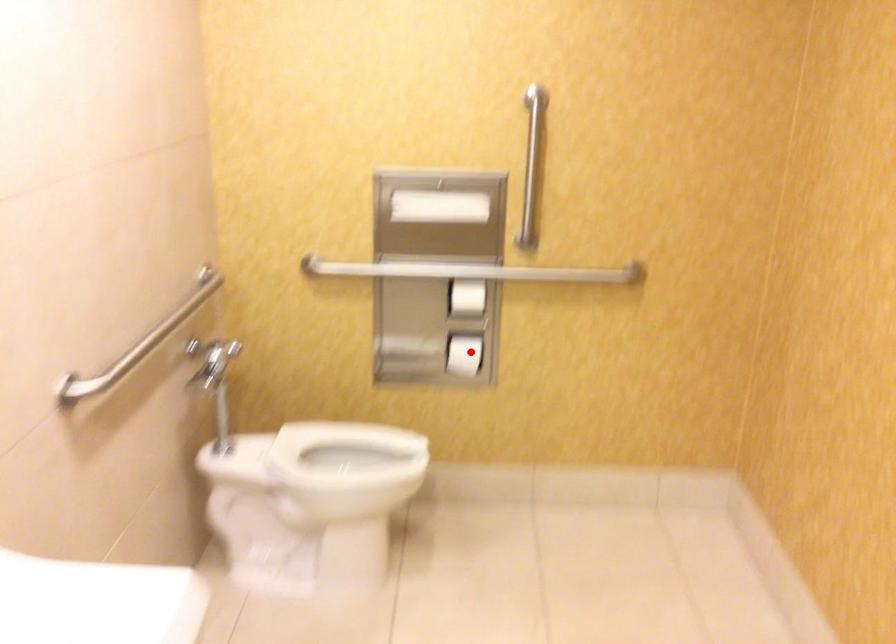
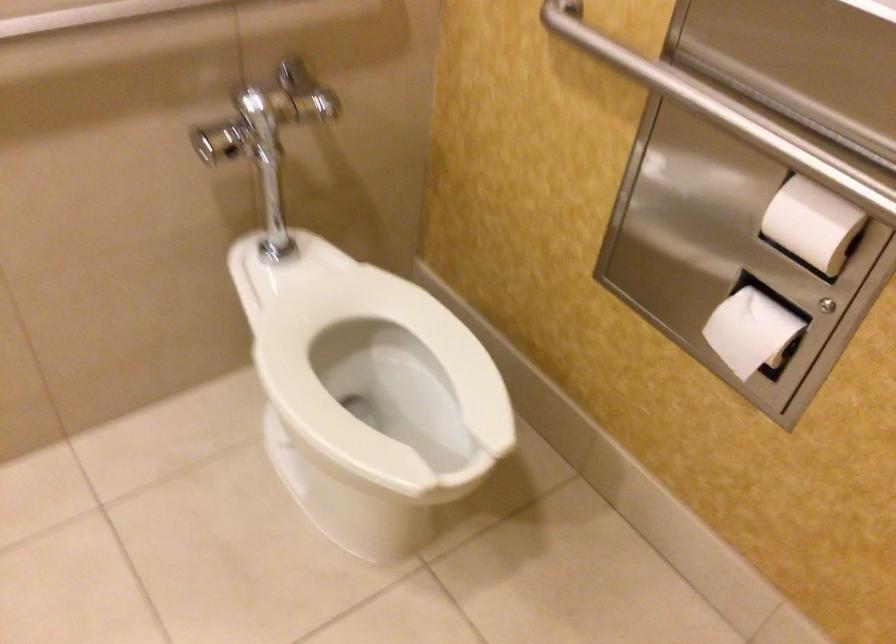
Question: I am providing you with two images of the same scene from different viewpoints. Given a red point in image1, look at the same physical point in image2. Is it:

Choices:
 (A) Closer to the viewpoint
 (B) Farther from the viewpoint

Answer: (A)